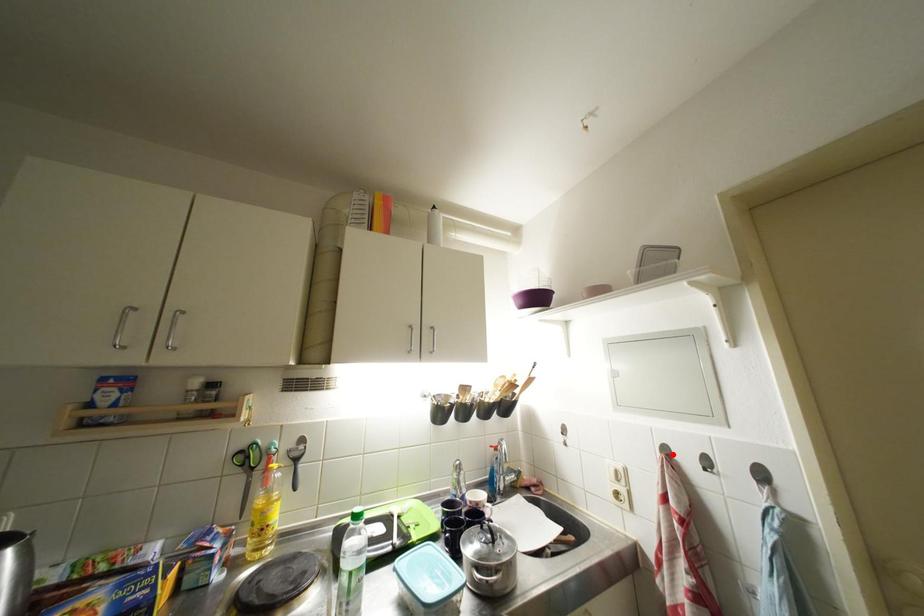
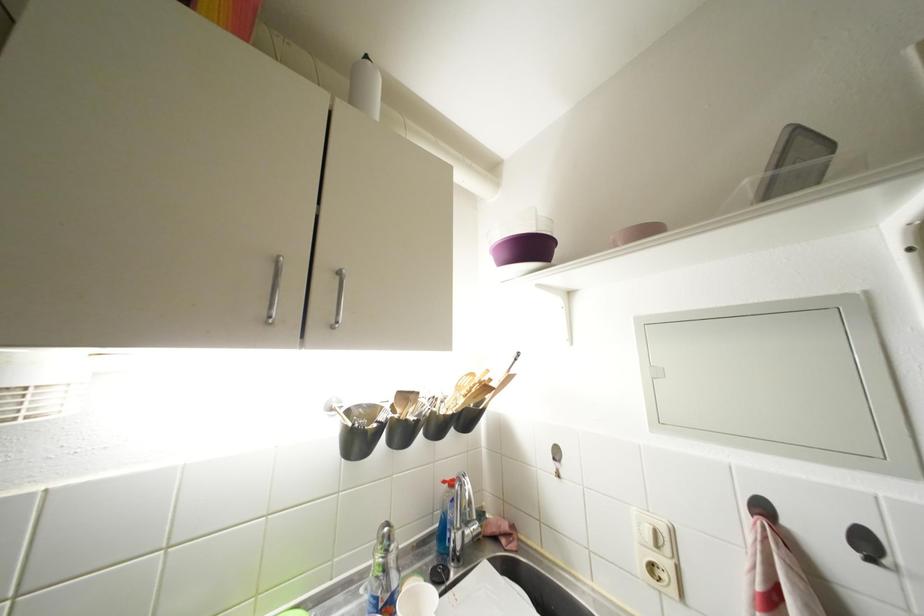
Locate, in the second image, the point that corresponds to the highlighted location in the first image.

(770, 513)